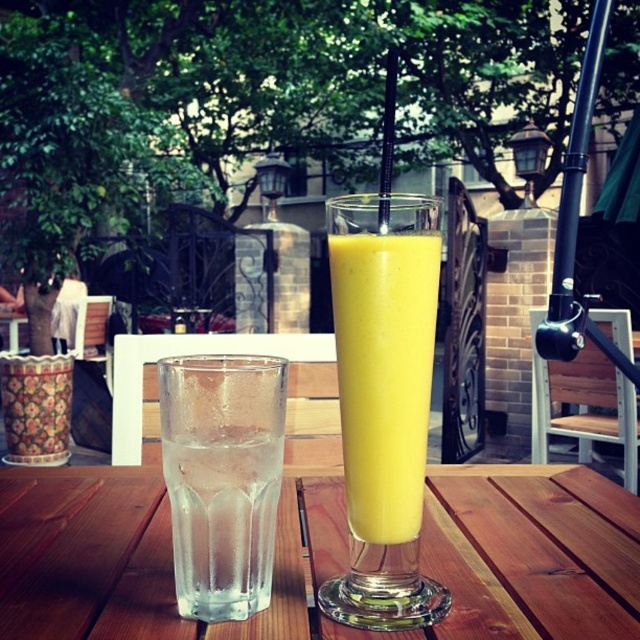
Question: Considering the relative positions of clear glass at left and yellow smoothie at center in the image provided, where is clear glass at left located with respect to yellow smoothie at center?

Choices:
 (A) right
 (B) left

Answer: (B)

Question: Does transparent glass at center appear over yellow smoothie at center?

Choices:
 (A) yes
 (B) no

Answer: (B)

Question: Among these objects, which one is nearest to the camera?

Choices:
 (A) clear glass at left
 (B) transparent glass at center

Answer: (A)

Question: Which is nearer to the clear glass at left?

Choices:
 (A) yellow smoothie at center
 (B) transparent glass at center

Answer: (A)

Question: Is transparent glass at center positioned in front of clear glass at left?

Choices:
 (A) yes
 (B) no

Answer: (B)

Question: Which point appears farthest from the camera in this image?

Choices:
 (A) (499, 602)
 (B) (241, 568)
 (C) (344, 256)

Answer: (A)